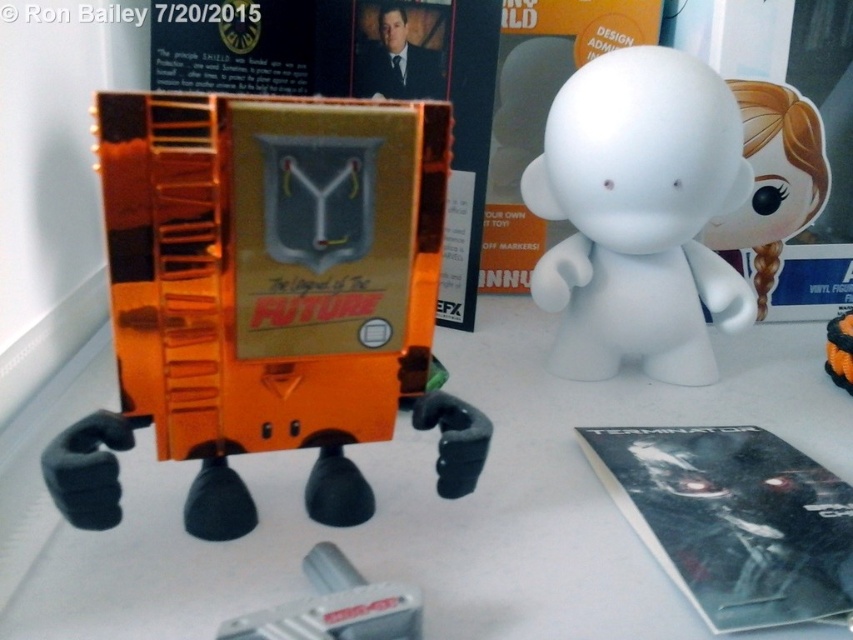
You are organizing items on a desk and need to place a new item between the translucent orange plastic toy at center and the metallic gray tool at lower center. Where should you place it?

The translucent orange plastic toy at center is on the left side of the metallic gray tool at lower center, so place the new item between them to the right of the toy and left of the tool.

You are standing at the edge of the table looking at the translucent orange plastic toy at center and the white matte figurine at center. Which object is closer to you?

The translucent orange plastic toy at center is closer to you because it is in front of the white matte figurine at center.

You are positioning a new item on the table and need to place it exactly where the translucent orange plastic toy at center is currently located. What are the coordinates of that location?

The translucent orange plastic toy at center is located at point (267, 298).